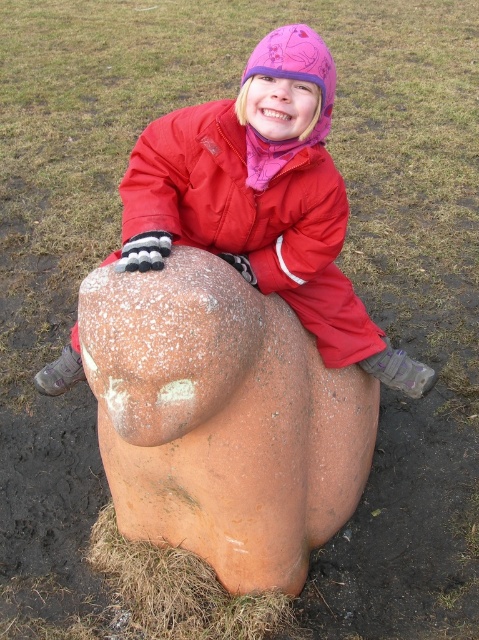
Between point (123, 275) and point (266, 77), which one is positioned behind?

The point (266, 77) is behind.

Can you confirm if rusty stone bear at center is bigger than matte red snowsuit at center?

Yes.

The image size is (479, 640). What do you see at coordinates (221, 419) in the screenshot? I see `rusty stone bear at center` at bounding box center [221, 419].

The image size is (479, 640). Identify the location of rusty stone bear at center. (221, 419).

Is rusty stone bear at center below red matte jacket at center?

Yes, rusty stone bear at center is below red matte jacket at center.

Which is behind, point (177, 330) or point (319, 205)?

Positioned behind is point (319, 205).

Image resolution: width=479 pixels, height=640 pixels. Describe the element at coordinates (221, 419) in the screenshot. I see `rusty stone bear at center` at that location.

Locate an element on the screen. rusty stone bear at center is located at coordinates click(x=221, y=419).

Who is shorter, matte red snowsuit at center or red matte jacket at center?

Standing shorter between the two is red matte jacket at center.

Does point (41, 381) come behind point (341, 353)?

Yes.

In order to click on matte red snowsuit at center in this screenshot , I will do `click(262, 198)`.